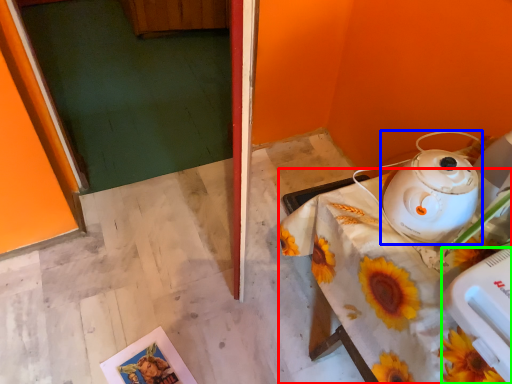
Question: Estimate the real-world distances between objects in this image. Which object is closer to table (highlighted by a red box), kettle (highlighted by a blue box) or appliance (highlighted by a green box)?

Choices:
 (A) kettle
 (B) appliance

Answer: (A)